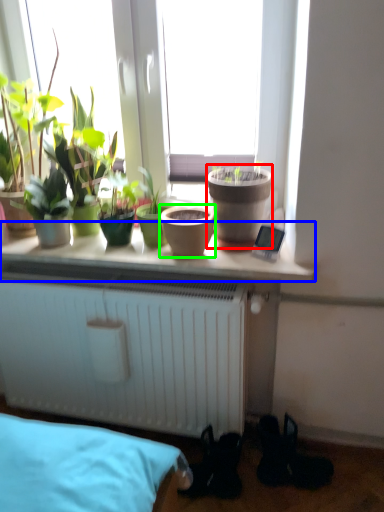
Question: Estimate the real-world distances between objects in this image. Which object is closer to flowerpot (highlighted by a red box), window sill (highlighted by a blue box) or flowerpot (highlighted by a green box)?

Choices:
 (A) window sill
 (B) flowerpot

Answer: (B)